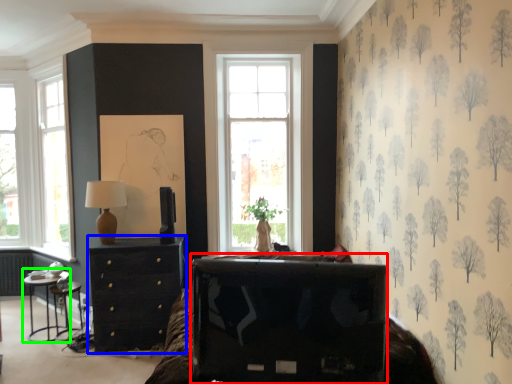
Question: Estimate the real-world distances between objects in this image. Which object is closer to furniture (highlighted by a red box), chest of drawers (highlighted by a blue box) or table (highlighted by a green box)?

Choices:
 (A) chest of drawers
 (B) table

Answer: (A)